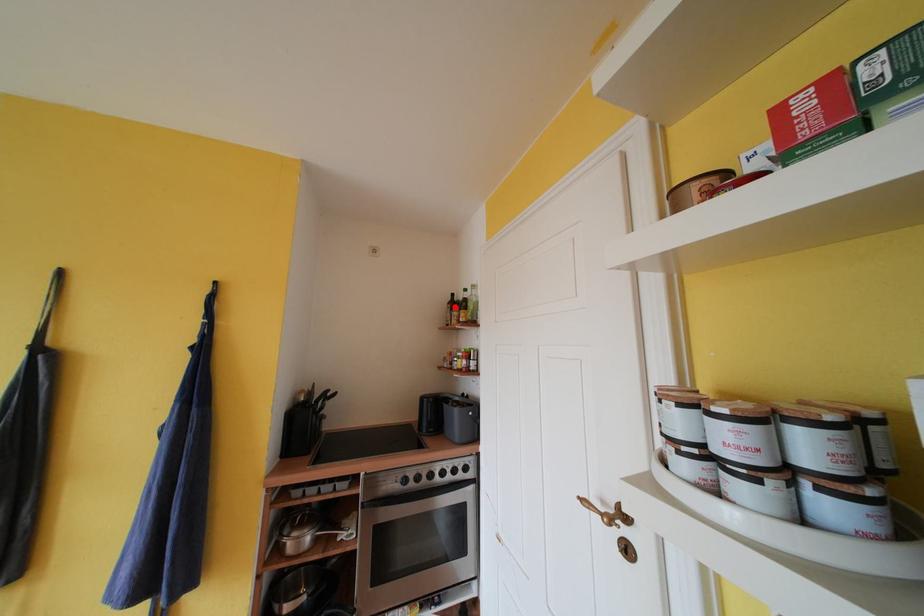
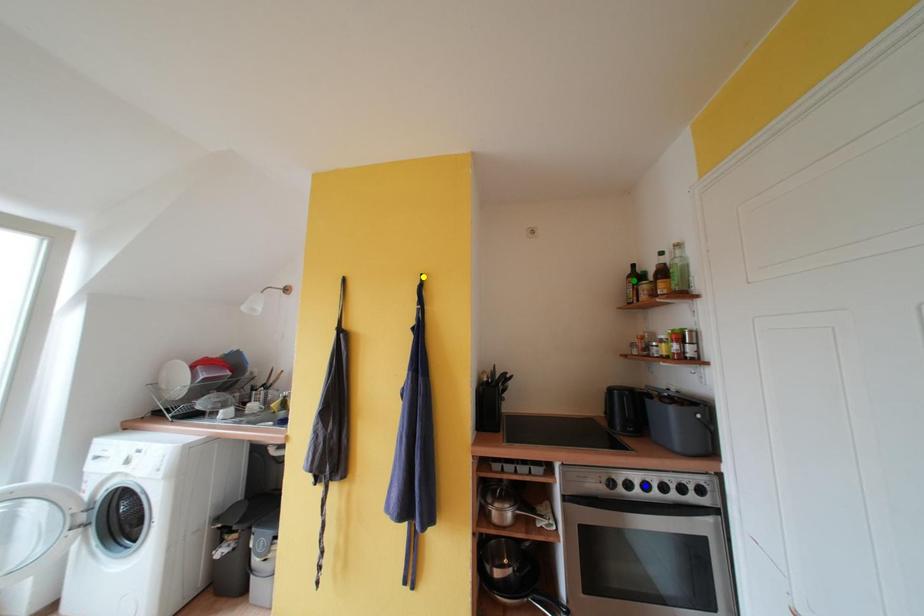
Question: I am providing you with two images of the same scene from different viewpoints. A red point is marked on the first image. You are given multiple points on the second image. In image 2, which mark is for the same physical point as the one in image 1?

Choices:
 (A) yellow point
 (B) blue point
 (C) green point

Answer: (C)